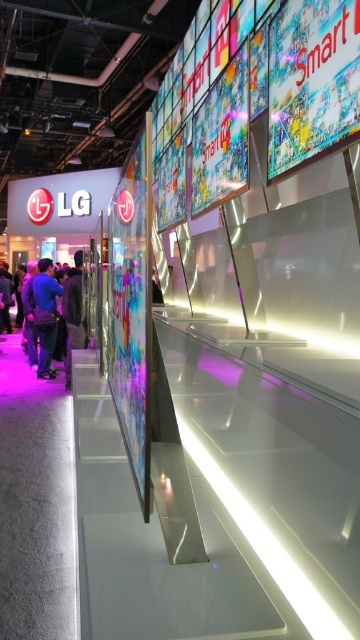
You are at the LG exhibition booth and notice two people in the foreground. One is wearing a blue fabric shirt at left, and the other has a dark gray jacket at left. From your perspective, which clothing item is positioned more to the left?

The blue fabric shirt at left is positioned more to the left compared to the dark gray jacket at left.

You are standing in the center of the exhibition booth. Where is the blue fabric shirt at left located relative to your position?

The blue fabric shirt at left is located at the lower left side of the booth, near the corner closest to the entrance.

You are a photographer at the event and need to capture a clear photo of the dark blue shirt at center without the blue fabric shirt at left blocking it. Can you adjust your position to achieve this?

Yes, since the dark blue shirt at center is in front of the blue fabric shirt at left, you can position yourself so that the dark blue shirt at center is centered in your frame, ensuring the blue fabric shirt at left is out of the shot or obscured by the foreground subject.